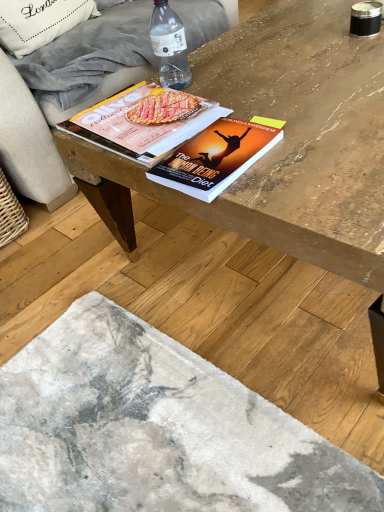
You are a GUI agent. You are given a task and a screenshot of the screen. Output one action in this format:
    pyautogui.click(x=<x>, y=<y>)
    Task: Click on the spots to the right of transparent plastic bottle at upper center
    This screenshot has width=384, height=512.
    Given the screenshot: What is the action you would take?
    pyautogui.click(x=238, y=72)